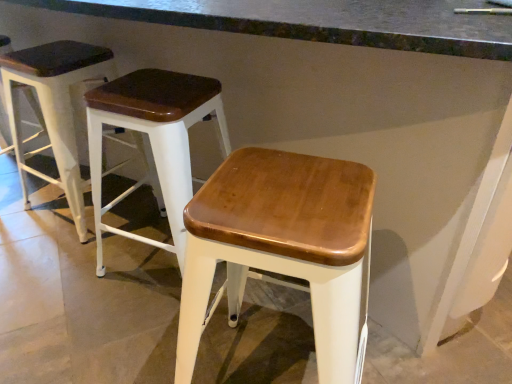
What is the approximate height of wooden seat at center, the third stool when ordered from left to right?

It is 26.10 inches.

The width and height of the screenshot is (512, 384). In order to click on smooth concrete at center in this screenshot , I will do `click(79, 299)`.

What do you see at coordinates (153, 140) in the screenshot? I see `wooden seat at center, the 2th stool from the left` at bounding box center [153, 140].

The image size is (512, 384). Find the location of `wooden seat stool at left, which is the first stool in left-to-right order`. wooden seat stool at left, which is the first stool in left-to-right order is located at coordinates (54, 109).

Locate an element on the screen. The height and width of the screenshot is (384, 512). wooden seat at center, the 1th stool positioned from the right is located at coordinates (283, 248).

In the scene shown: From the image's perspective, does wooden seat stool at left, which is the first stool in left-to-right order, appear lower than wooden seat at center, the 2th stool from the left?

No.

Is wooden seat stool at left, the third stool in the right-to-left sequence, far away from wooden seat at center, the 2th stool from the left?

No.

Does wooden seat stool at left, the third stool in the right-to-left sequence, have a lesser width compared to wooden seat at center, the second stool in the right-to-left sequence?

Correct, the width of wooden seat stool at left, the third stool in the right-to-left sequence, is less than that of wooden seat at center, the second stool in the right-to-left sequence.

Relative to wooden seat at center, the 2th stool from the left, is wooden seat stool at left, which is the first stool in left-to-right order, in front or behind?

Clearly, wooden seat stool at left, which is the first stool in left-to-right order, is behind wooden seat at center, the 2th stool from the left.

Does wooden seat at center, the 1th stool positioned from the right, touch smooth concrete at center?

No, wooden seat at center, the 1th stool positioned from the right, is not in contact with smooth concrete at center.

Does wooden seat at center, the 1th stool positioned from the right, have a greater width compared to smooth concrete at center?

In fact, wooden seat at center, the 1th stool positioned from the right, might be narrower than smooth concrete at center.

Who is more distant, wooden seat at center, the 1th stool positioned from the right, or smooth concrete at center?

wooden seat at center, the 1th stool positioned from the right, is more distant.

Could you measure the distance between wooden seat at center, the third stool when ordered from left to right, and smooth concrete at center?

wooden seat at center, the third stool when ordered from left to right, and smooth concrete at center are 54.24 centimeters apart.

Is smooth concrete at center positioned with its back to wooden seat stool at left, the third stool in the right-to-left sequence?

No, smooth concrete at center is not facing away from wooden seat stool at left, the third stool in the right-to-left sequence.

From a real-world perspective, relative to wooden seat stool at left, the third stool in the right-to-left sequence, is smooth concrete at center vertically above or below?

In terms of real-world spatial position, smooth concrete at center is above wooden seat stool at left, the third stool in the right-to-left sequence.

Is smooth concrete at center situated inside wooden seat stool at left, the third stool in the right-to-left sequence, or outside?

smooth concrete at center is not enclosed by wooden seat stool at left, the third stool in the right-to-left sequence.

Can you confirm if smooth concrete at center is wider than wooden seat at center, the 1th stool positioned from the right?

Indeed, smooth concrete at center has a greater width compared to wooden seat at center, the 1th stool positioned from the right.

Looking at the image, does smooth concrete at center seem bigger or smaller compared to wooden seat at center, the third stool when ordered from left to right?

Considering their sizes, smooth concrete at center takes up more space than wooden seat at center, the third stool when ordered from left to right.

From a real-world perspective, count 1st stools downward from the smooth concrete at center and point to it. Please provide its 2D coordinates.

[(283, 248)]

Which of these two, smooth concrete at center or wooden seat at center, the 1th stool positioned from the right, stands taller?

With more height is smooth concrete at center.

From a real-world perspective, relative to smooth concrete at center, is wooden seat at center, the 2th stool from the left, vertically above or below?

In terms of real-world spatial position, wooden seat at center, the 2th stool from the left, is below smooth concrete at center.

Considering the relative sizes of wooden seat at center, the 2th stool from the left, and smooth concrete at center in the image provided, is wooden seat at center, the 2th stool from the left, shorter than smooth concrete at center?

Correct, wooden seat at center, the 2th stool from the left, is not as tall as smooth concrete at center.

Is wooden seat at center, the 2th stool from the left, at the left side of smooth concrete at center?

No.

Which object is further away from the camera, wooden seat at center, the second stool in the right-to-left sequence, or smooth concrete at center?

wooden seat at center, the second stool in the right-to-left sequence, is further away from the camera.

Which object is wider, wooden seat at center, the second stool in the right-to-left sequence, or wooden seat at center, the third stool when ordered from left to right?

Wider between the two is wooden seat at center, the second stool in the right-to-left sequence.

I want to click on the 1st stool above the wooden seat at center, the 1th stool positioned from the right (from the image's perspective), so click(153, 140).

From the image's perspective, is wooden seat at center, the third stool when ordered from left to right, on wooden seat stool at left, the third stool in the right-to-left sequence?

No.

Locate an element on the screen. stool above the wooden seat stool at left, the third stool in the right-to-left sequence (from a real-world perspective) is located at coordinates (283, 248).

From a real-world perspective, which is physically below, wooden seat at center, the third stool when ordered from left to right, or wooden seat stool at left, the third stool in the right-to-left sequence?

From a 3D spatial view, wooden seat stool at left, the third stool in the right-to-left sequence, is below.

In terms of width, does wooden seat at center, the third stool when ordered from left to right, look wider or thinner when compared to wooden seat stool at left, which is the first stool in left-to-right order?

In the image, wooden seat at center, the third stool when ordered from left to right, appears to be more narrow than wooden seat stool at left, which is the first stool in left-to-right order.

From the wooden seat stool at left, which is the first stool in left-to-right order, count 1st stools forward and point to it. Please provide its 2D coordinates.

[(153, 140)]

Find the location of `the 1st stool behind the smooth concrete at center`. the 1st stool behind the smooth concrete at center is located at coordinates click(x=283, y=248).

Consider the image. Looking at the image, which one is located closer to wooden seat at center, the 2th stool from the left, wooden seat at center, the 1th stool positioned from the right, or smooth concrete at center?

Among the two, smooth concrete at center is located nearer to wooden seat at center, the 2th stool from the left.

When comparing their distances from wooden seat at center, the 2th stool from the left, does wooden seat at center, the third stool when ordered from left to right, or wooden seat stool at left, which is the first stool in left-to-right order, seem closer?

wooden seat stool at left, which is the first stool in left-to-right order.

From the image, which object appears to be nearer to wooden seat stool at left, which is the first stool in left-to-right order, wooden seat at center, the 2th stool from the left, or wooden seat at center, the 1th stool positioned from the right?

Based on the image, wooden seat at center, the 2th stool from the left, appears to be nearer to wooden seat stool at left, which is the first stool in left-to-right order.

Which object lies nearer to the anchor point wooden seat at center, the third stool when ordered from left to right, wooden seat at center, the second stool in the right-to-left sequence, or smooth concrete at center?

Based on the image, wooden seat at center, the second stool in the right-to-left sequence, appears to be nearer to wooden seat at center, the third stool when ordered from left to right.

Which object lies nearer to the anchor point wooden seat stool at left, which is the first stool in left-to-right order, wooden seat at center, the third stool when ordered from left to right, or smooth concrete at center?

Based on the image, smooth concrete at center appears to be nearer to wooden seat stool at left, which is the first stool in left-to-right order.

Which object lies nearer to the anchor point wooden seat at center, the 2th stool from the left, smooth concrete at center or wooden seat stool at left, which is the first stool in left-to-right order?

Based on the image, smooth concrete at center appears to be nearer to wooden seat at center, the 2th stool from the left.

Which object lies further to the anchor point wooden seat at center, the second stool in the right-to-left sequence, smooth concrete at center or wooden seat at center, the third stool when ordered from left to right?

wooden seat at center, the third stool when ordered from left to right.

Estimate the real-world distances between objects in this image. Which object is further from smooth concrete at center, wooden seat at center, the second stool in the right-to-left sequence, or wooden seat at center, the 1th stool positioned from the right?

wooden seat at center, the 1th stool positioned from the right, is further to smooth concrete at center.

Locate an element on the screen. This screenshot has width=512, height=384. stool situated between wooden seat stool at left, the third stool in the right-to-left sequence, and wooden seat at center, the 1th stool positioned from the right, from left to right is located at coordinates (153, 140).

At what (x,y) coordinates should I click in order to perform the action: click on stool between smooth concrete at center and wooden seat at center, the 2th stool from the left, along the z-axis. Please return your answer as a coordinate pair (x, y). Image resolution: width=512 pixels, height=384 pixels. Looking at the image, I should click on (283, 248).